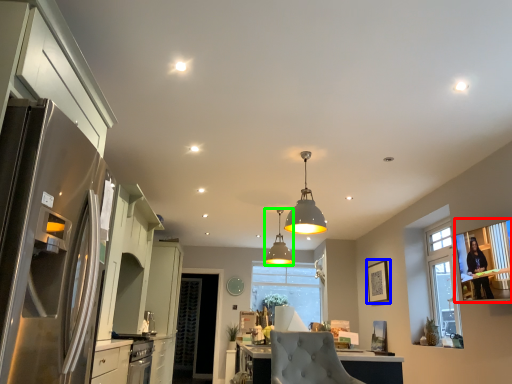
Question: Estimate the real-world distances between objects in this image. Which object is closer to window screen (highlighted by a red box), picture frame (highlighted by a blue box) or lamp (highlighted by a green box)?

Choices:
 (A) picture frame
 (B) lamp

Answer: (A)